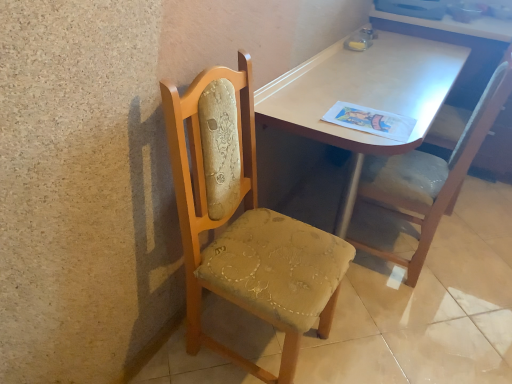
At what (x,y) coordinates should I click in order to perform the action: click on vacant point to the right of woodenchair at left, the 1th chair viewed from the left. Please return your answer as a coordinate pair (x, y). Looking at the image, I should click on (374, 345).